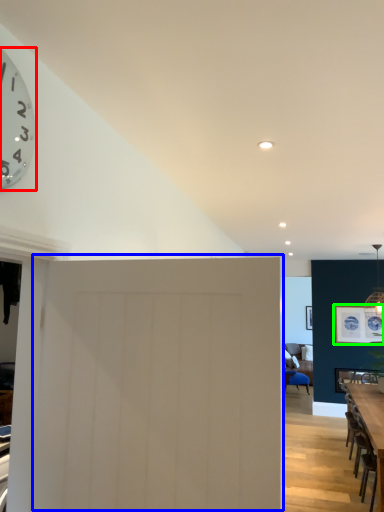
Question: Which object is the farthest from wall clock (highlighted by a red box)? Choose among these: door (highlighted by a blue box) or picture frame (highlighted by a green box).

Choices:
 (A) door
 (B) picture frame

Answer: (B)